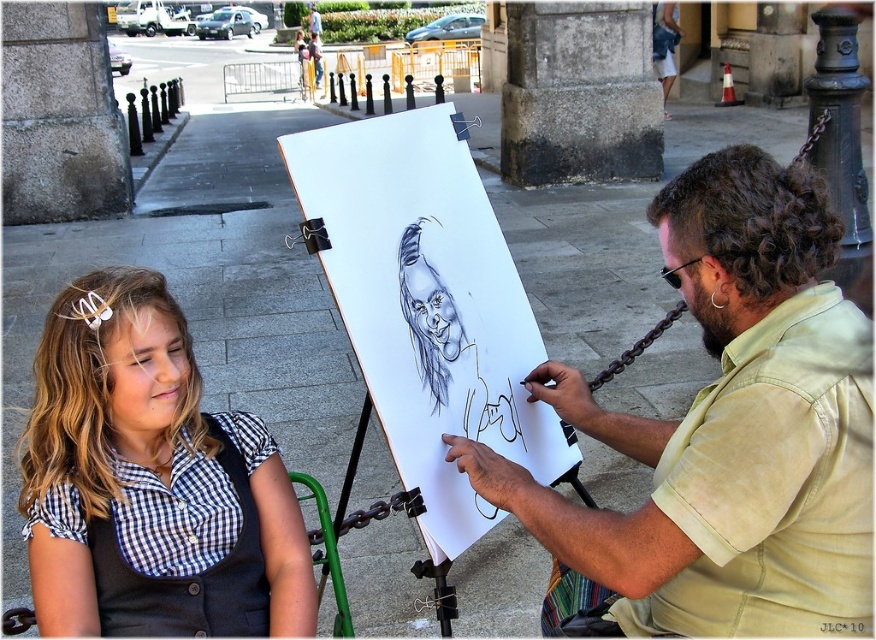
Question: Which object is positioned closest to the light beige shirt at center?

Choices:
 (A) white paper at center
 (B) checkered fabric at lower left

Answer: (A)

Question: Which of these objects is positioned closest to the checkered fabric at lower left?

Choices:
 (A) white paper at center
 (B) light beige shirt at center

Answer: (A)

Question: Considering the relative positions of checkered fabric at lower left and white paper at center in the image provided, where is checkered fabric at lower left located with respect to white paper at center?

Choices:
 (A) below
 (B) above

Answer: (A)

Question: Which is nearer to the checkered fabric at lower left?

Choices:
 (A) white paper at center
 (B) light beige shirt at center

Answer: (A)

Question: Is checkered fabric at lower left above white paper at center?

Choices:
 (A) no
 (B) yes

Answer: (A)

Question: Can you confirm if checkered fabric at lower left is positioned below white paper at center?

Choices:
 (A) no
 (B) yes

Answer: (B)